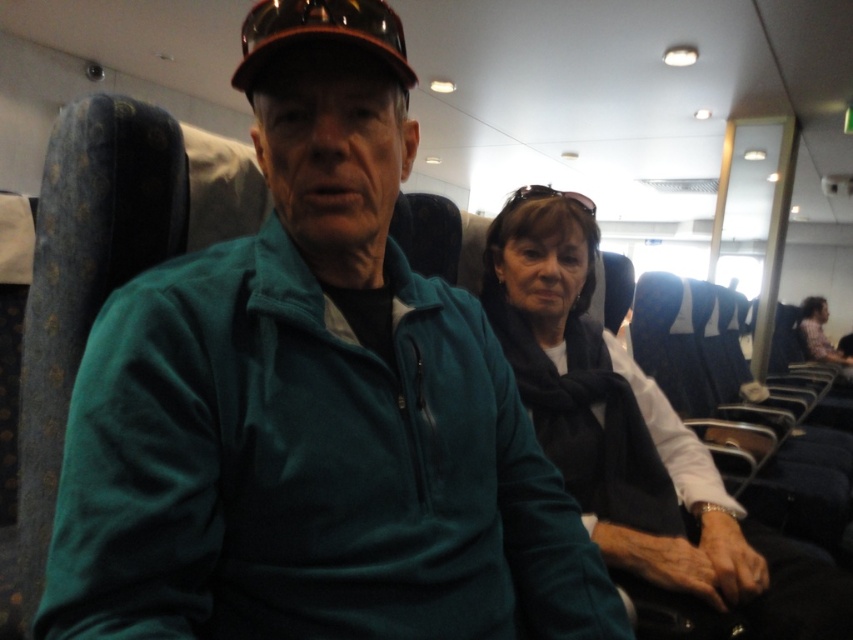
Question: Estimate the real-world distances between objects in this image. Which object is closer to the brown matte baseball cap at upper center?

Choices:
 (A) dark gray scarf at center
 (B) black fabric scarf at center

Answer: (B)

Question: Observing the image, what is the correct spatial positioning of black fabric scarf at center in reference to dark gray scarf at center?

Choices:
 (A) right
 (B) left

Answer: (B)

Question: Which object is closer to the camera taking this photo?

Choices:
 (A) black fabric scarf at center
 (B) brown matte baseball cap at upper center

Answer: (B)

Question: Is black fabric scarf at center behind dark gray scarf at center?

Choices:
 (A) yes
 (B) no

Answer: (B)

Question: Is brown matte baseball cap at upper center to the right of dark gray scarf at center from the viewer's perspective?

Choices:
 (A) yes
 (B) no

Answer: (B)

Question: Which point is closer to the camera taking this photo?

Choices:
 (A) (271, 36)
 (B) (140, 556)

Answer: (B)